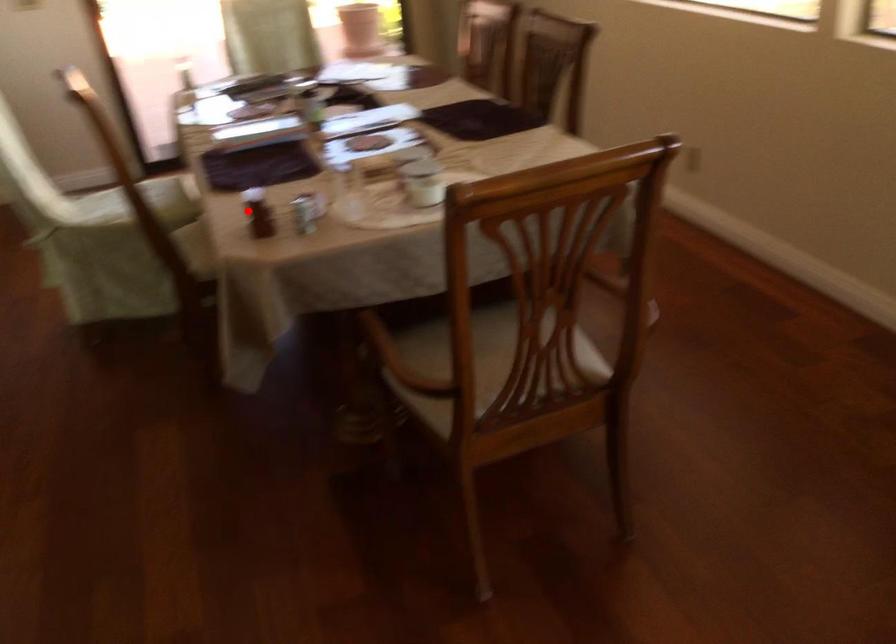
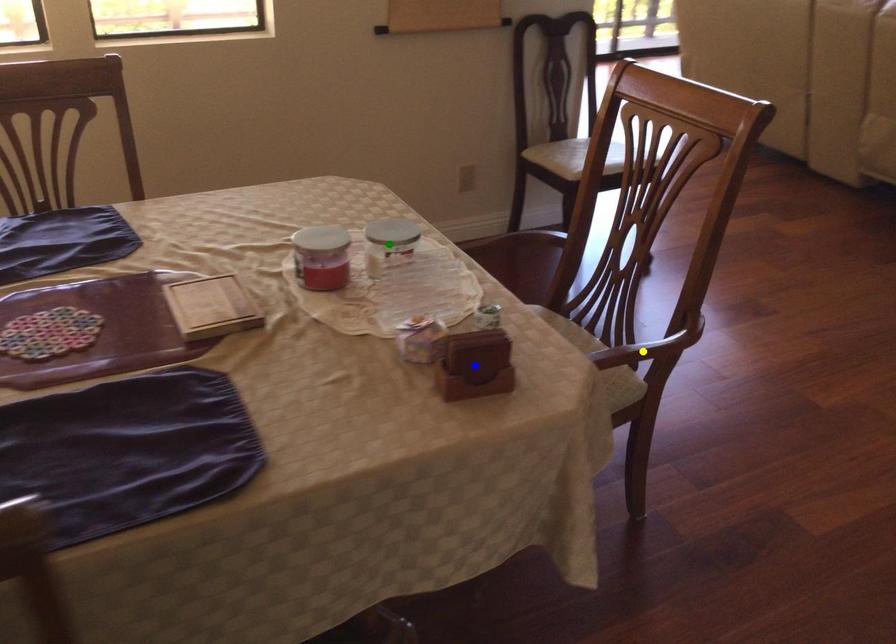
Question: I am providing you with two images of the same scene from different viewpoints. A red point is marked on the first image. You are given multiple points on the second image. Which point in image 2 represents the same 3d spot as the red point in image 1?

Choices:
 (A) green point
 (B) blue point
 (C) yellow point

Answer: (B)